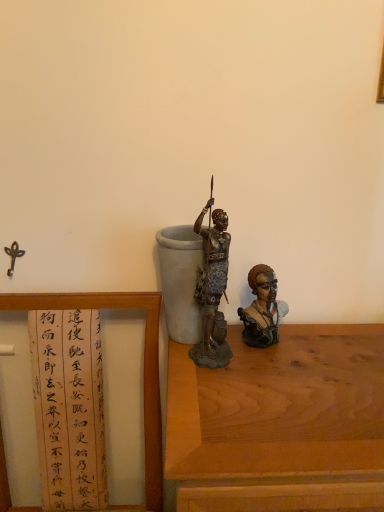
Where is `free space to the right of bronze statue at center, the second person when ordered from right to left`? This screenshot has width=384, height=512. free space to the right of bronze statue at center, the second person when ordered from right to left is located at coordinates (299, 361).